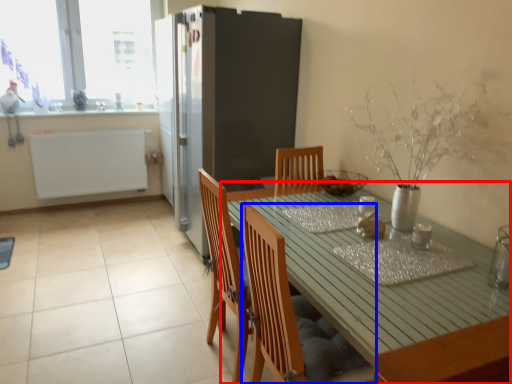
Question: Which of the following is the farthest to the observer, table (highlighted by a red box) or chair (highlighted by a blue box)?

Choices:
 (A) table
 (B) chair

Answer: (B)